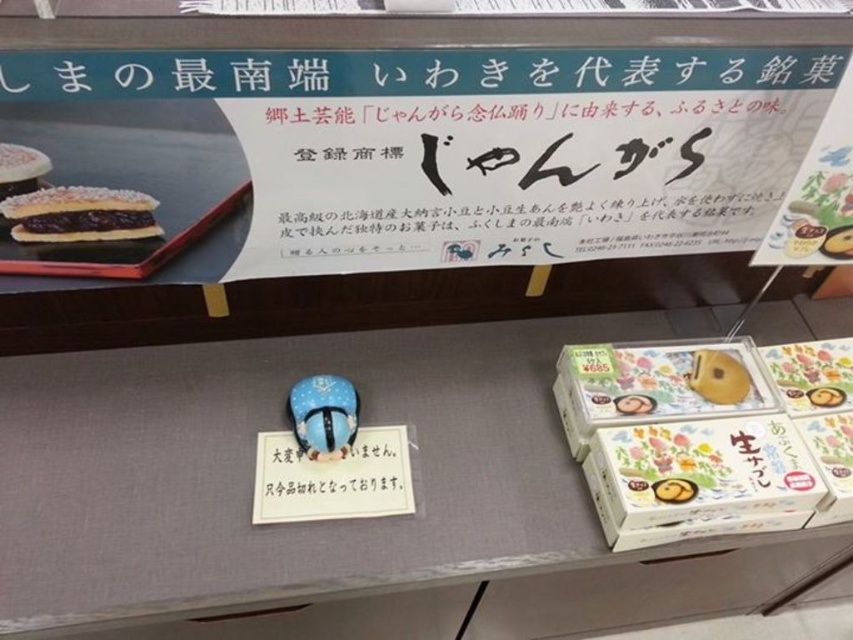
Question: Which object appears closest to the camera in this image?

Choices:
 (A) blue glossy figurine at center
 (B) floral-patterned cardboard box at right
 (C) gray fabric table at center

Answer: (C)

Question: Among these objects, which one is nearest to the camera?

Choices:
 (A) black paper at center
 (B) matte chocolate cake at upper left
 (C) matte white box at center

Answer: (B)

Question: Can you confirm if black paper at center is wider than golden matte cookie at center?

Choices:
 (A) yes
 (B) no

Answer: (A)

Question: Does gray fabric table at center appear under floral-patterned cardboard box at right?

Choices:
 (A) yes
 (B) no

Answer: (A)

Question: Which of the following is the closest to the observer?

Choices:
 (A) (231, 401)
 (B) (672, 509)
 (C) (380, 490)
 (D) (291, 416)

Answer: (B)

Question: Can you confirm if gray fabric table at center is positioned above matte chocolate cake at upper left?

Choices:
 (A) yes
 (B) no

Answer: (B)